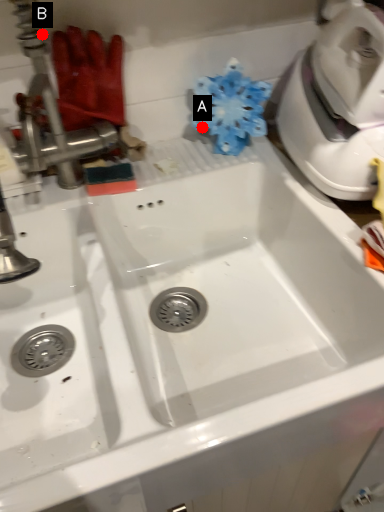
Question: Two points are circled on the image, labeled by A and B beside each circle. Which point appears farthest from the camera in this image?

Choices:
 (A) A is further
 (B) B is further

Answer: (A)